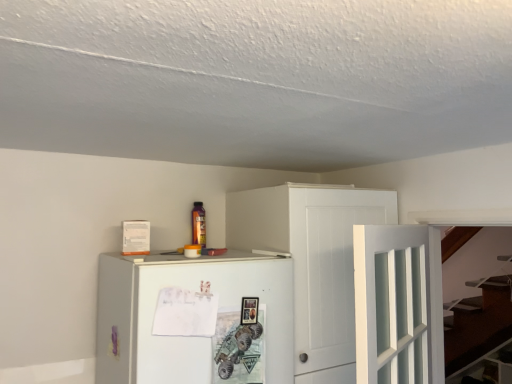
Question: Does white wood cabinet at upper center turn towards white glass door at center-right?

Choices:
 (A) no
 (B) yes

Answer: (B)

Question: Can you confirm if white wood cabinet at upper center is wider than white glass door at center-right?

Choices:
 (A) yes
 (B) no

Answer: (A)

Question: Considering the relative positions of white wood cabinet at upper center and white glass door at center-right in the image provided, is white wood cabinet at upper center to the left of white glass door at center-right from the viewer's perspective?

Choices:
 (A) no
 (B) yes

Answer: (B)

Question: Is white wood cabinet at upper center turned away from white glass door at center-right?

Choices:
 (A) yes
 (B) no

Answer: (A)

Question: From the image's perspective, is white wood cabinet at upper center under white glass door at center-right?

Choices:
 (A) no
 (B) yes

Answer: (B)

Question: From a real-world perspective, does white wood cabinet at upper center stand above white glass door at center-right?

Choices:
 (A) no
 (B) yes

Answer: (A)

Question: Could white wood cabinet at upper center be considered to be inside white matte refrigerator at center?

Choices:
 (A) no
 (B) yes

Answer: (A)

Question: Is white matte refrigerator at center smaller than white wood cabinet at upper center?

Choices:
 (A) yes
 (B) no

Answer: (A)

Question: Does white matte refrigerator at center come behind white wood cabinet at upper center?

Choices:
 (A) no
 (B) yes

Answer: (A)

Question: Can you confirm if white matte refrigerator at center is thinner than white wood cabinet at upper center?

Choices:
 (A) yes
 (B) no

Answer: (B)

Question: Is white matte refrigerator at center aimed at white wood cabinet at upper center?

Choices:
 (A) yes
 (B) no

Answer: (B)

Question: Does white matte refrigerator at center have a greater height compared to white wood cabinet at upper center?

Choices:
 (A) yes
 (B) no

Answer: (B)

Question: Is white wood cabinet at upper center completely or partially inside white glass door at center-right?

Choices:
 (A) yes
 (B) no

Answer: (B)